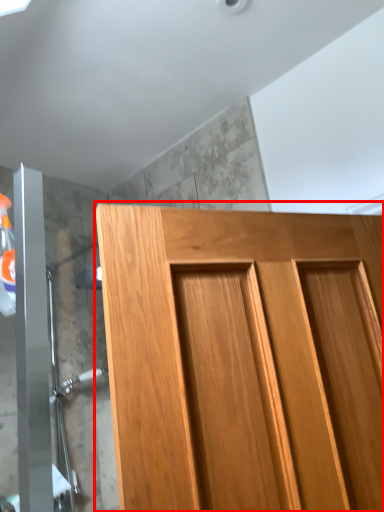
Question: From the image, what is the correct spatial relationship of door (annotated by the red box) in relation to shower door?

Choices:
 (A) right
 (B) left

Answer: (A)